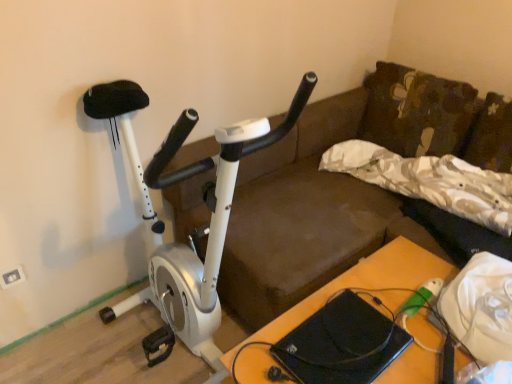
Question: Can you confirm if white plastic electric outlet at upper left is wider than white metallic stationary bicycle at left?

Choices:
 (A) yes
 (B) no

Answer: (B)

Question: Is white plastic electric outlet at upper left further to the viewer compared to white metallic stationary bicycle at left?

Choices:
 (A) no
 (B) yes

Answer: (B)

Question: From a real-world perspective, is white plastic electric outlet at upper left positioned over white metallic stationary bicycle at left based on gravity?

Choices:
 (A) yes
 (B) no

Answer: (B)

Question: Is white metallic stationary bicycle at left at the back of white plastic electric outlet at upper left?

Choices:
 (A) no
 (B) yes

Answer: (A)

Question: Can you confirm if white plastic electric outlet at upper left is positioned to the right of white metallic stationary bicycle at left?

Choices:
 (A) yes
 (B) no

Answer: (B)

Question: Relative to white metallic stationary bicycle at left, is wooden table at lower right in front or behind?

Choices:
 (A) behind
 (B) front

Answer: (A)

Question: Would you say wooden table at lower right is inside or outside white metallic stationary bicycle at left?

Choices:
 (A) outside
 (B) inside

Answer: (A)

Question: From the image's perspective, is wooden table at lower right located above or below white metallic stationary bicycle at left?

Choices:
 (A) above
 (B) below

Answer: (B)

Question: Is point (268, 360) closer or farther from the camera than point (174, 142)?

Choices:
 (A) closer
 (B) farther

Answer: (B)

Question: Is camouflage fabric pillow at center wider or thinner than white plastic electric outlet at upper left?

Choices:
 (A) thin
 (B) wide

Answer: (B)

Question: Is camouflage fabric pillow at center inside the boundaries of white plastic electric outlet at upper left, or outside?

Choices:
 (A) outside
 (B) inside

Answer: (A)

Question: In the image, is camouflage fabric pillow at center positioned in front of or behind white plastic electric outlet at upper left?

Choices:
 (A) front
 (B) behind

Answer: (A)

Question: From a real-world perspective, is camouflage fabric pillow at center physically located above or below white plastic electric outlet at upper left?

Choices:
 (A) above
 (B) below

Answer: (A)

Question: In terms of width, does white metallic stationary bicycle at left look wider or thinner when compared to white plastic electric outlet at upper left?

Choices:
 (A) wide
 (B) thin

Answer: (A)

Question: From their relative heights in the image, would you say white metallic stationary bicycle at left is taller or shorter than white plastic electric outlet at upper left?

Choices:
 (A) short
 (B) tall

Answer: (B)